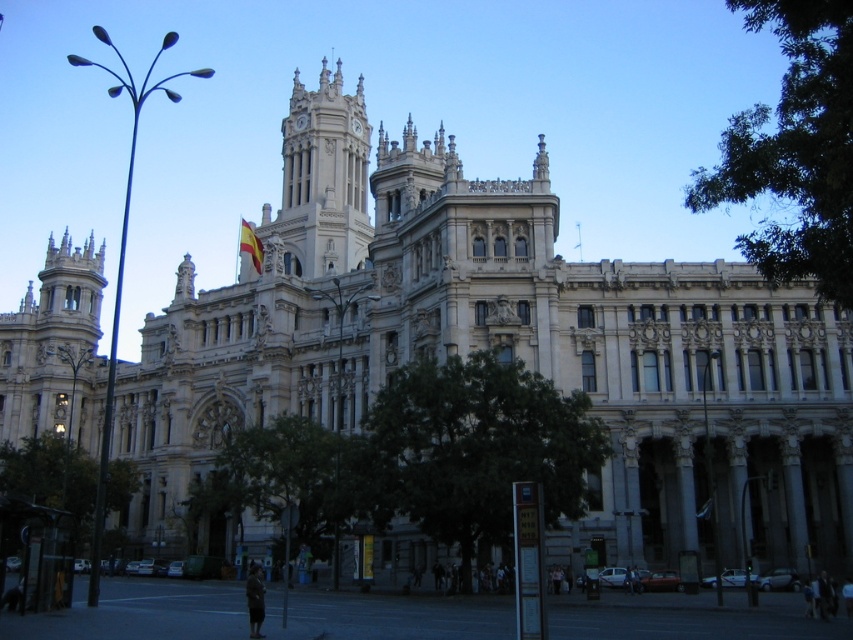
You are standing at a certain point and want to take a photo of the grand building. The point you are standing at is labeled as point (328, 147). Given that the distance from this point to the camera is 110.16 meters, can you estimate how far you are from the building?

The distance between point (328, 147) and the camera is 110.16 meters, so you are approximately 110.16 meters away from the building.

You are standing in front of a grand building with a central tower. There is a point marked at coordinates (x=323, y=179). What does this point most likely represent on the building?

The point at coordinates (x=323, y=179) corresponds to the white stone clock tower at upper center of the building.